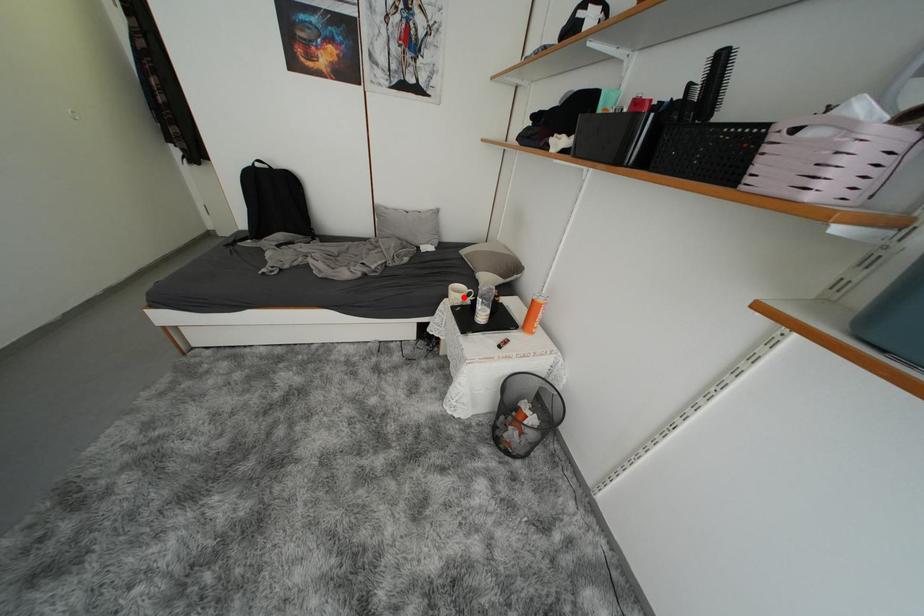
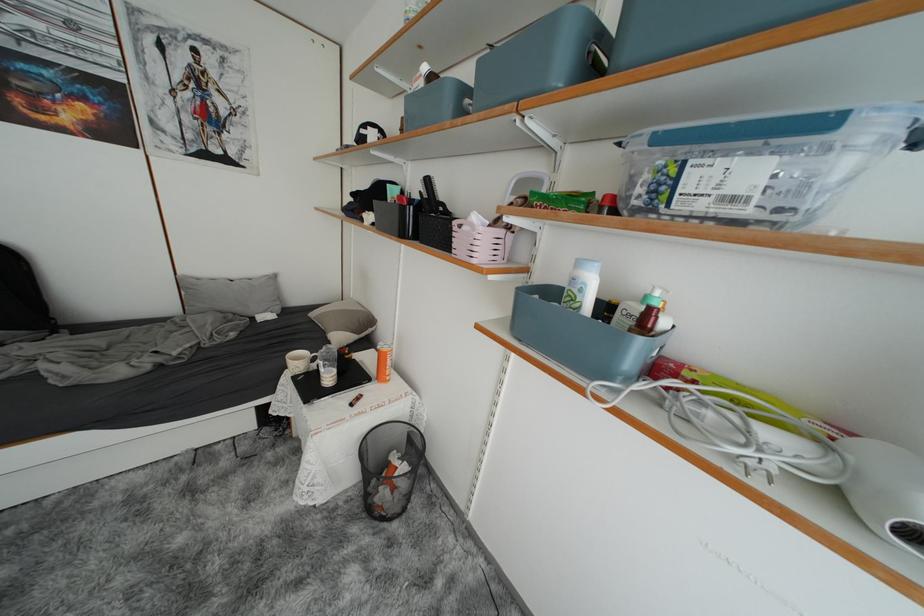
Question: I am providing you with two images of the same scene from different viewpoints. A red point is shown in image1. For the corresponding object point in image2, is it positioned nearer or farther from the camera?

Choices:
 (A) Nearer
 (B) Farther

Answer: (B)